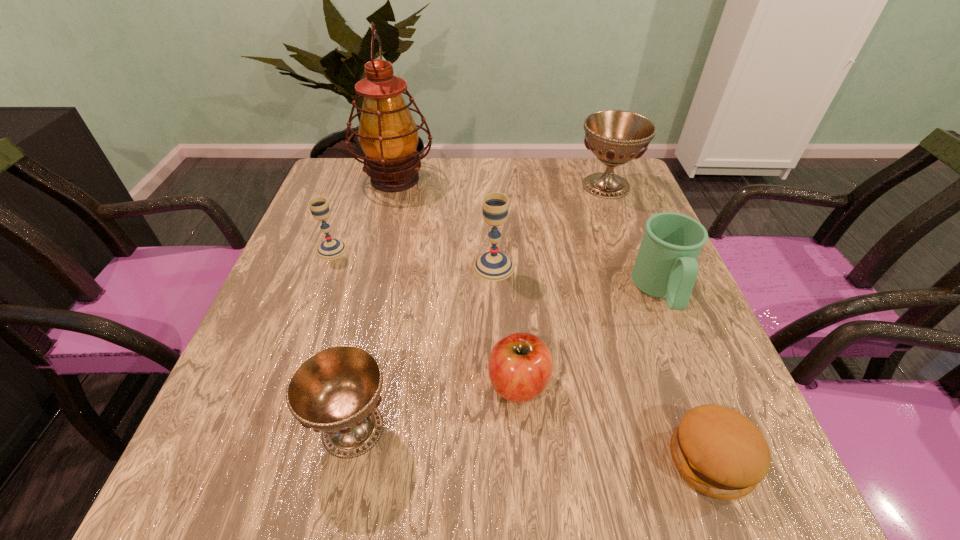
The width and height of the screenshot is (960, 540). In order to click on object positioned at the far left corner in this screenshot , I will do `click(388, 135)`.

Locate an element on the screen. This screenshot has height=540, width=960. object that is at the far right corner is located at coordinates (615, 137).

Locate an element on the screen. object situated at the near right corner is located at coordinates (717, 450).

Where is `vacant space at the far edge of the desktop`? This screenshot has height=540, width=960. vacant space at the far edge of the desktop is located at coordinates (503, 190).

Locate an element on the screen. vacant space at the near edge of the desktop is located at coordinates (674, 508).

Identify the location of vacant area at the left edge. (287, 444).

In the image, there is a desktop. Where is `free region at the right edge`? The height and width of the screenshot is (540, 960). free region at the right edge is located at coordinates (667, 441).

I want to click on vacant space at the near left corner of the desktop, so click(236, 487).

At what (x,y) coordinates should I click in order to perform the action: click on free spot between the right red chalice and the third chalice from left to right. Please return your answer as a coordinate pair (x, y). Image resolution: width=960 pixels, height=540 pixels. Looking at the image, I should click on (550, 226).

Find the location of a particular element. Image resolution: width=960 pixels, height=540 pixels. empty space that is in between the right gray chalice and the second shortest object is located at coordinates (506, 325).